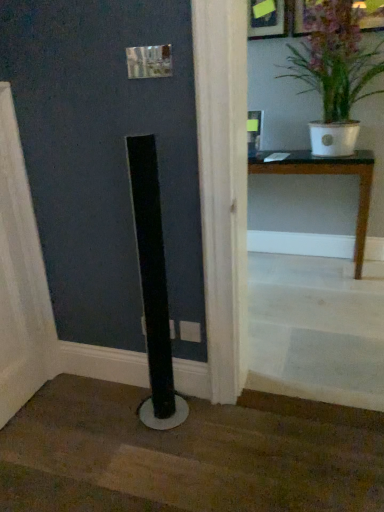
This screenshot has width=384, height=512. In order to click on space that is in front of wooden table at center in this screenshot , I will do `click(312, 298)`.